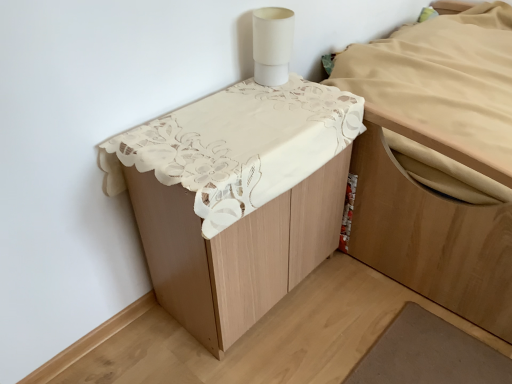
Where is `light brown wood bed at upper right, the second furniture from the left`? light brown wood bed at upper right, the second furniture from the left is located at coordinates (438, 160).

Can you tell me how much white matte cylindrical lamp at upper right and light brown wood bed at upper right, the first furniture when ordered from right to left, differ in facing direction?

178 degrees separate the facing orientations of white matte cylindrical lamp at upper right and light brown wood bed at upper right, the first furniture when ordered from right to left.

Is point (254, 59) farther from camera compared to point (488, 69)?

That is False.

Is light brown wood bed at upper right, the first furniture when ordered from right to left, at the back of white matte cylindrical lamp at upper right?

white matte cylindrical lamp at upper right does not have its back to light brown wood bed at upper right, the first furniture when ordered from right to left.

Can you confirm if white matte cylindrical lamp at upper right is positioned to the left of light brown wood bed at upper right, the first furniture when ordered from right to left?

Yes.

From the image's perspective, which one is positioned higher, light brown wood bed at upper right, the second furniture from the left, or white matte cylindrical lamp at upper right?

white matte cylindrical lamp at upper right.

From a real-world perspective, is light brown wood bed at upper right, the first furniture when ordered from right to left, beneath white matte cylindrical lamp at upper right?

Yes, from a real-world perspective, light brown wood bed at upper right, the first furniture when ordered from right to left, is under white matte cylindrical lamp at upper right.

Identify the location of lamp positioned vertically above the light brown wood bed at upper right, the second furniture from the left (from a real-world perspective). The image size is (512, 384). (272, 44).

Does light brown wood bed at upper right, the second furniture from the left, have a lesser width compared to white matte cylindrical lamp at upper right?

No, light brown wood bed at upper right, the second furniture from the left, is not thinner than white matte cylindrical lamp at upper right.

From a real-world perspective, who is located lower, light brown wood bed at upper right, the first furniture when ordered from right to left, or white lace tablecloth at upper center, acting as the second furniture starting from the right?

white lace tablecloth at upper center, acting as the second furniture starting from the right, from a real-world perspective.

Considering the sizes of objects light brown wood bed at upper right, the first furniture when ordered from right to left, and white lace tablecloth at upper center, acting as the second furniture starting from the right, in the image provided, who is wider, light brown wood bed at upper right, the first furniture when ordered from right to left, or white lace tablecloth at upper center, acting as the second furniture starting from the right,?

light brown wood bed at upper right, the first furniture when ordered from right to left, is wider.

Is light brown wood bed at upper right, the first furniture when ordered from right to left, positioned before white lace tablecloth at upper center, acting as the second furniture starting from the right?

No, the depth of light brown wood bed at upper right, the first furniture when ordered from right to left, is greater than that of white lace tablecloth at upper center, acting as the second furniture starting from the right.

Is light brown wood bed at upper right, the first furniture when ordered from right to left, far from white lace tablecloth at upper center, the 1th furniture from the left?

No.

Is white matte cylindrical lamp at upper right spatially inside white lace tablecloth at upper center, acting as the second furniture starting from the right, or outside of it?

white matte cylindrical lamp at upper right is located beyond the bounds of white lace tablecloth at upper center, acting as the second furniture starting from the right.

Which object is wider, white matte cylindrical lamp at upper right or white lace tablecloth at upper center, acting as the second furniture starting from the right?

white lace tablecloth at upper center, acting as the second furniture starting from the right.

Considering the positions of objects white matte cylindrical lamp at upper right and white lace tablecloth at upper center, acting as the second furniture starting from the right, in the image provided, who is more to the right, white matte cylindrical lamp at upper right or white lace tablecloth at upper center, acting as the second furniture starting from the right,?

From the viewer's perspective, white matte cylindrical lamp at upper right appears more on the right side.

Based on their sizes in the image, would you say white matte cylindrical lamp at upper right is bigger or smaller than white lace tablecloth at upper center, acting as the second furniture starting from the right?

In the image, white matte cylindrical lamp at upper right appears to be smaller than white lace tablecloth at upper center, acting as the second furniture starting from the right.

From the image's perspective, relative to white matte cylindrical lamp at upper right, is white lace tablecloth at upper center, the 1th furniture from the left, above or below?

Based on their image positions, white lace tablecloth at upper center, the 1th furniture from the left, is located beneath white matte cylindrical lamp at upper right.

Does white lace tablecloth at upper center, acting as the second furniture starting from the right, have a greater height compared to white matte cylindrical lamp at upper right?

Indeed, white lace tablecloth at upper center, acting as the second furniture starting from the right, has a greater height compared to white matte cylindrical lamp at upper right.

Considering the points (223, 265) and (280, 57), which point is in front, point (223, 265) or point (280, 57)?

The point (223, 265) is closer to the camera.

Which is more to the left, white lace tablecloth at upper center, the 1th furniture from the left, or white matte cylindrical lamp at upper right?

Positioned to the left is white lace tablecloth at upper center, the 1th furniture from the left.

Between white lace tablecloth at upper center, acting as the second furniture starting from the right, and light brown wood bed at upper right, the second furniture from the left, which one appears on the left side from the viewer's perspective?

From the viewer's perspective, white lace tablecloth at upper center, acting as the second furniture starting from the right, appears more on the left side.

Can we say white lace tablecloth at upper center, acting as the second furniture starting from the right, lies outside light brown wood bed at upper right, the second furniture from the left?

white lace tablecloth at upper center, acting as the second furniture starting from the right, is positioned outside light brown wood bed at upper right, the second furniture from the left.

Is white lace tablecloth at upper center, the 1th furniture from the left, far away from light brown wood bed at upper right, the first furniture when ordered from right to left?

No, white lace tablecloth at upper center, the 1th furniture from the left, is not far away from light brown wood bed at upper right, the first furniture when ordered from right to left.

How distant is white lace tablecloth at upper center, the 1th furniture from the left, from light brown wood bed at upper right, the second furniture from the left?

white lace tablecloth at upper center, the 1th furniture from the left, is 15.54 inches away from light brown wood bed at upper right, the second furniture from the left.

I want to click on lamp to the left of light brown wood bed at upper right, the first furniture when ordered from right to left, so click(x=272, y=44).

Locate an element on the screen. This screenshot has width=512, height=384. the 1st furniture positioned below the white matte cylindrical lamp at upper right (from a real-world perspective) is located at coordinates (438, 160).

Looking at the image, which one is located further to white lace tablecloth at upper center, acting as the second furniture starting from the right, white matte cylindrical lamp at upper right or light brown wood bed at upper right, the first furniture when ordered from right to left?

light brown wood bed at upper right, the first furniture when ordered from right to left, lies further to white lace tablecloth at upper center, acting as the second furniture starting from the right, than the other object.

Looking at the image, which one is located closer to white matte cylindrical lamp at upper right, light brown wood bed at upper right, the second furniture from the left, or white lace tablecloth at upper center, acting as the second furniture starting from the right?

The object closer to white matte cylindrical lamp at upper right is white lace tablecloth at upper center, acting as the second furniture starting from the right.

Which object lies nearer to the anchor point light brown wood bed at upper right, the first furniture when ordered from right to left, white lace tablecloth at upper center, acting as the second furniture starting from the right, or white matte cylindrical lamp at upper right?

Among the two, white lace tablecloth at upper center, acting as the second furniture starting from the right, is located nearer to light brown wood bed at upper right, the first furniture when ordered from right to left.

From the image, which object appears to be farther from white lace tablecloth at upper center, the 1th furniture from the left, light brown wood bed at upper right, the second furniture from the left, or white matte cylindrical lamp at upper right?

light brown wood bed at upper right, the second furniture from the left, is further to white lace tablecloth at upper center, the 1th furniture from the left.

Looking at the image, which one is located further to white matte cylindrical lamp at upper right, white lace tablecloth at upper center, acting as the second furniture starting from the right, or light brown wood bed at upper right, the second furniture from the left?

Among the two, light brown wood bed at upper right, the second furniture from the left, is located further to white matte cylindrical lamp at upper right.

From the image, which object appears to be nearer to light brown wood bed at upper right, the first furniture when ordered from right to left, white matte cylindrical lamp at upper right or white lace tablecloth at upper center, the 1th furniture from the left?

white lace tablecloth at upper center, the 1th furniture from the left.

The width and height of the screenshot is (512, 384). Identify the location of lamp between white lace tablecloth at upper center, the 1th furniture from the left, and light brown wood bed at upper right, the second furniture from the left, in the horizontal direction. (272, 44).